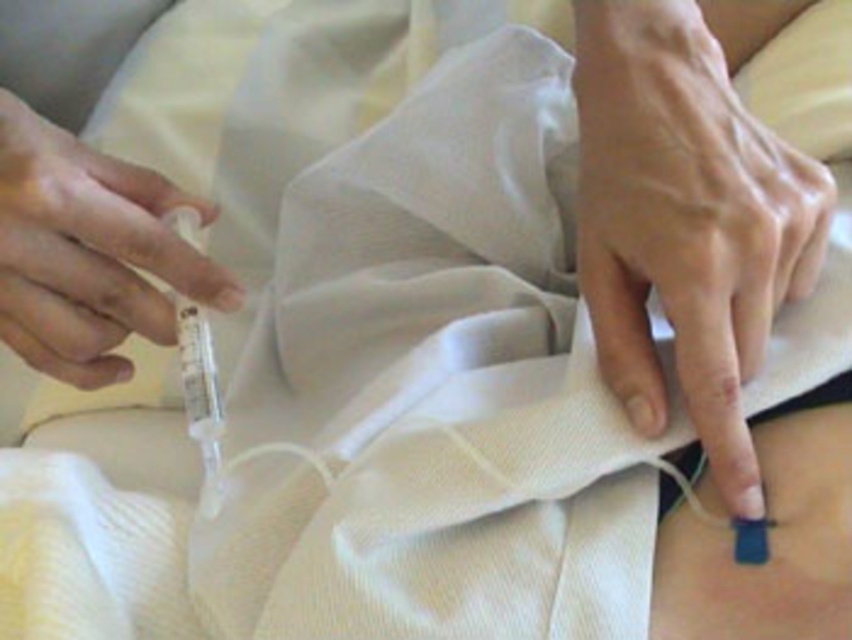
You are a nurse preparing to attach a medical device to the patient. The device requires a minimum of 5 inches of clear space between the skin and the sensor to function properly. Based on the scene, will the distance between the smooth skin at lower right and the blue matte sensor at lower right meet this requirement?

The smooth skin at lower right is 4.07 inches away from the blue matte sensor at lower right. Since 4.07 inches is less than the required 5 inches, the distance does not meet the requirement, so the device will not function properly.

You are a nurse preparing to administer an injection. You see the transparent plastic syringe at left and the blue matte sensor at lower right. Which object is located to the left of the other?

The transparent plastic syringe at left is positioned on the left side of blue matte sensor at lower right.

You are a nurse preparing to administer an injection. You have a transparent plastic syringe at left and a blue matte sensor at lower right. Which object is wider?

The transparent plastic syringe at left is wider than the blue matte sensor at lower right.